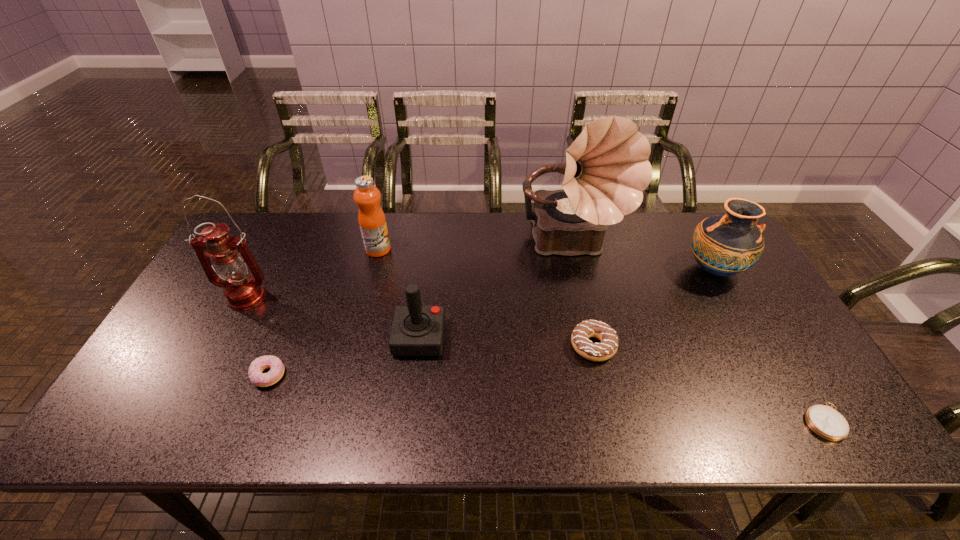
Identify the location of blank space that satisfies the following two spatial constraints: 1. on the front side of the shortest object; 2. on the right side of the left doughnut. This screenshot has width=960, height=540. (251, 422).

The height and width of the screenshot is (540, 960). I want to click on free point that satisfies the following two spatial constraints: 1. from the horn of the pottery; 2. on the left side of the record player, so click(x=579, y=270).